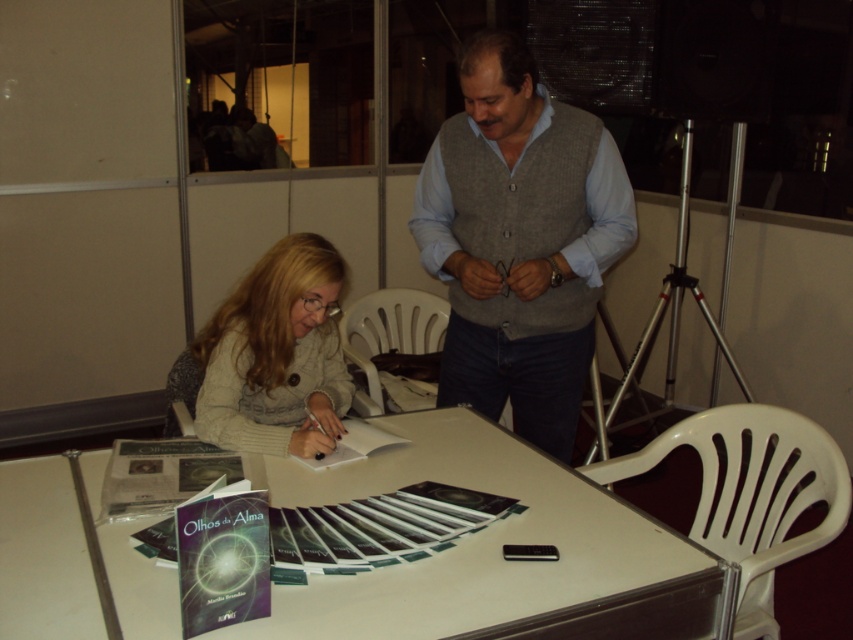
Is point (491, 452) more distant than point (306, 337)?

No, (491, 452) is closer to viewer.

Does white plastic table at center have a greater height compared to matte gray sweater at center-left?

In fact, white plastic table at center may be shorter than matte gray sweater at center-left.

Which is behind, point (468, 611) or point (277, 355)?

Point (277, 355)

Identify the location of white plastic table at center. (496, 550).

Who is higher up, gray knitted vest at center or matte gray sweater at center-left?

gray knitted vest at center is above.

Is point (587, 189) closer to camera compared to point (305, 436)?

No.

The image size is (853, 640). What are the coordinates of `gray knitted vest at center` in the screenshot? It's located at (519, 241).

Is white plastic table at center positioned in front of gray knitted vest at center?

Yes, white plastic table at center is in front of gray knitted vest at center.

Measure the distance between white plastic table at center and camera.

white plastic table at center is 1.19 meters from camera.

Find the location of a particular element. The width and height of the screenshot is (853, 640). white plastic table at center is located at coordinates (496, 550).